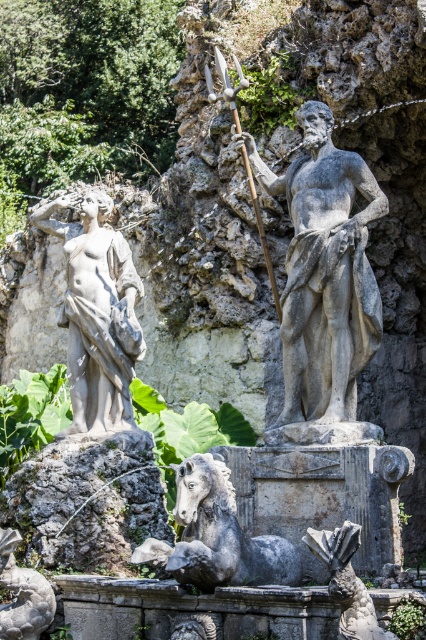
You are standing in front of the classical fountain and want to place a decorative plant between the gray stone statue at center and the statue on the right. Based on their positions, which statue is closer to the center of the fountain?

The gray stone statue at center is located at point (325, 273), which is closer to the center of the fountain compared to the statue on the right. Therefore, the decorative plant should be placed between them near the gray stone statue at center.

You are a tour guide leading a group around the classical fountain. You want to ensure everyone can see both the gray stone statue at center and the gray stone horse at center clearly. Considering the spacing between them, would you recommend standing closer to the statue or the horse to get a better view of both?

The distance between the gray stone statue at center and the gray stone horse at center is 24.02 feet. To see both clearly, you should stand at a point equidistant from both, ensuring you can view them without straining. Since they are spaced apart, positioning yourself midway between them would provide the best vantage point.

You are an art conservator assessing the fountain. You need to determine which object is shorter between the matte gray statue at left and the polished bronze spear at center. Which one is shorter?

The matte gray statue at left is shorter than the polished bronze spear at center according to the description.